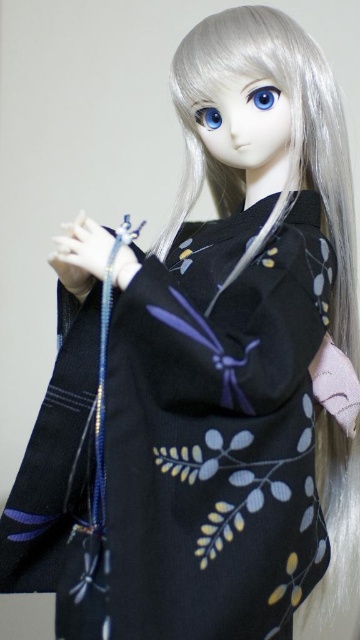
Question: Is blue glossy eye at center smaller than blue glossy eye at upper center?

Choices:
 (A) yes
 (B) no

Answer: (A)

Question: Which point is farther to the camera?

Choices:
 (A) blue glossy eye at upper center
 (B) blue glossy eye at center

Answer: (A)

Question: Can you confirm if blue glossy eye at center is wider than blue glossy eye at upper center?

Choices:
 (A) yes
 (B) no

Answer: (A)

Question: Does blue glossy eye at center have a larger size compared to blue glossy eye at upper center?

Choices:
 (A) yes
 (B) no

Answer: (B)